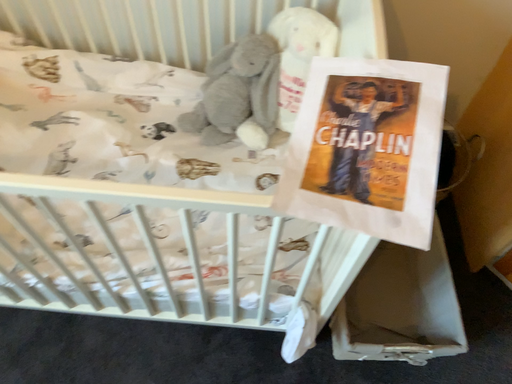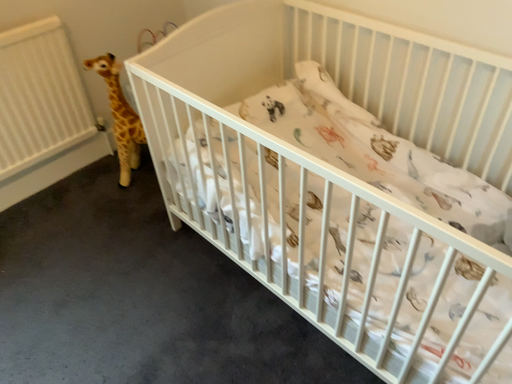
Question: How did the camera likely rotate when shooting the video?

Choices:
 (A) rotated right
 (B) rotated left

Answer: (B)